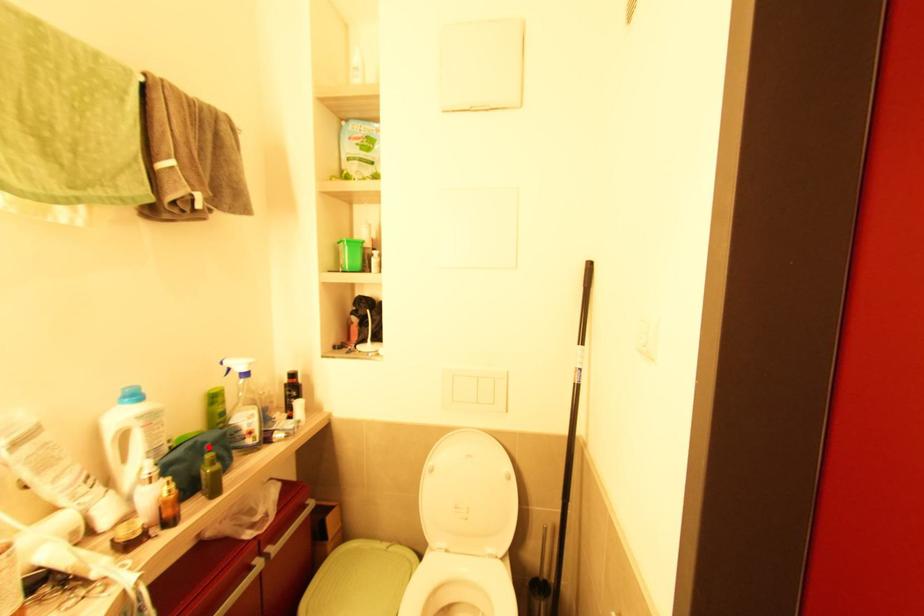
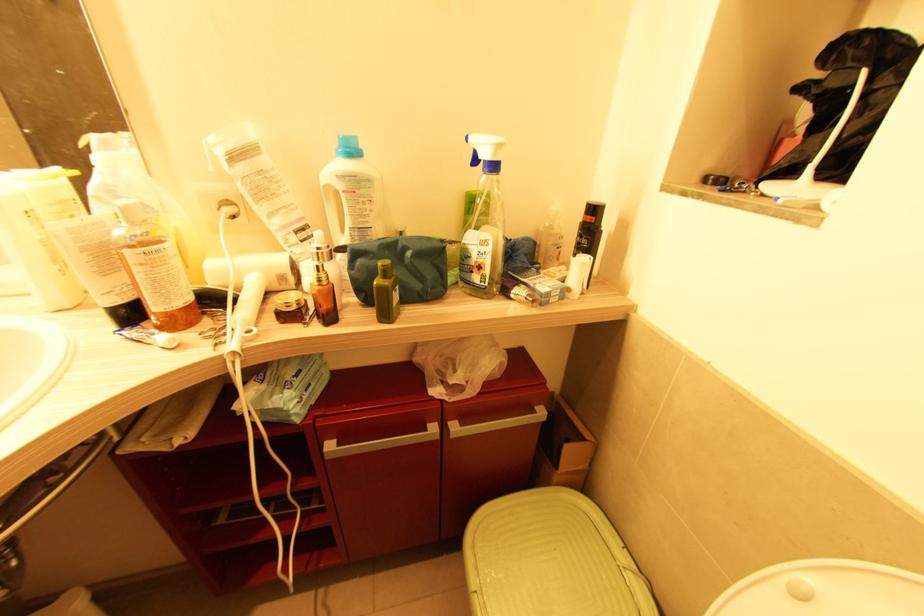
Locate, in the second image, the point that corresponds to the highlighted location in the first image.

(409, 254)